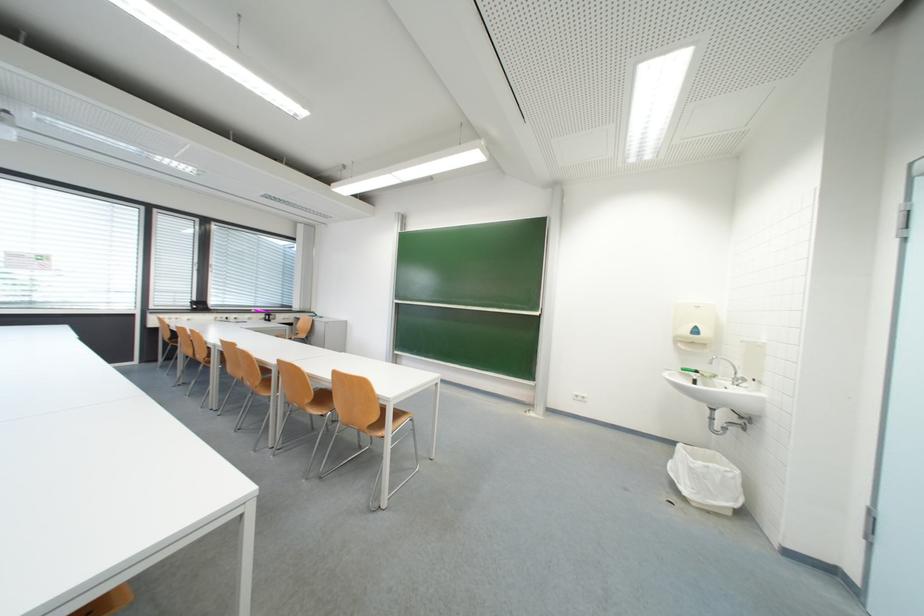
The width and height of the screenshot is (924, 616). What do you see at coordinates (869, 524) in the screenshot? I see `a metal door handle` at bounding box center [869, 524].